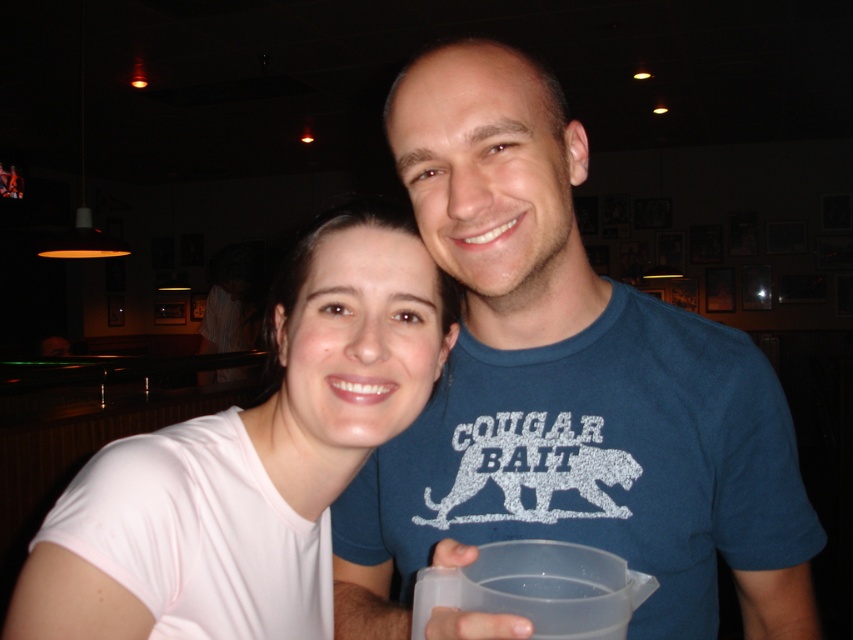
Is blue cotton t-shirt at upper center behind white matte shirt at center?

No, blue cotton t-shirt at upper center is in front of white matte shirt at center.

Can you confirm if blue cotton t-shirt at upper center is wider than white matte shirt at center?

Correct, the width of blue cotton t-shirt at upper center exceeds that of white matte shirt at center.

Which is in front, point (705, 364) or point (97, 570)?

Point (97, 570) is more forward.

This screenshot has height=640, width=853. In order to click on blue cotton t-shirt at upper center in this screenshot , I will do `click(566, 387)`.